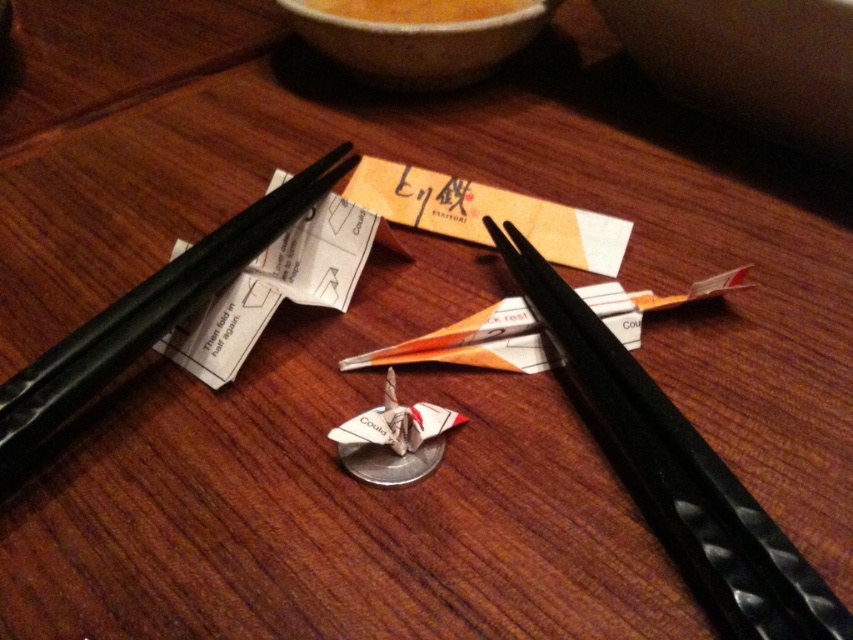
Does matte brown bowl at upper center have a larger size compared to black textured chopsticks at left?

Incorrect, matte brown bowl at upper center is not larger than black textured chopsticks at left.

Can you confirm if matte brown bowl at upper center is positioned above black textured chopsticks at left?

Correct, matte brown bowl at upper center is located above black textured chopsticks at left.

Is point (694, 20) positioned before point (152, 323)?

No.

This screenshot has width=853, height=640. What are the coordinates of `matte brown bowl at upper center` in the screenshot? It's located at (750, 64).

Who is lower down, matte brown bowl at upper center or matte ceramic bowl at upper center?

matte brown bowl at upper center is below.

Looking at this image, can you confirm if matte brown bowl at upper center is wider than matte ceramic bowl at upper center?

No, matte brown bowl at upper center is not wider than matte ceramic bowl at upper center.

You are a GUI agent. You are given a task and a screenshot of the screen. Output one action in this format:
    pyautogui.click(x=<x>, y=<y>)
    Task: Click on the matte brown bowl at upper center
    This screenshot has width=853, height=640.
    Given the screenshot: What is the action you would take?
    pyautogui.click(x=750, y=64)

Is black textured chopsticks at center to the left of orange matte bowl at upper center from the viewer's perspective?

No, black textured chopsticks at center is not to the left of orange matte bowl at upper center.

Identify the location of black textured chopsticks at center. (677, 474).

Where is `black textured chopsticks at center`? Image resolution: width=853 pixels, height=640 pixels. black textured chopsticks at center is located at coordinates (677, 474).

You are a GUI agent. You are given a task and a screenshot of the screen. Output one action in this format:
    pyautogui.click(x=<x>, y=<y>)
    Task: Click on the black textured chopsticks at center
    This screenshot has width=853, height=640.
    Given the screenshot: What is the action you would take?
    pyautogui.click(x=677, y=474)